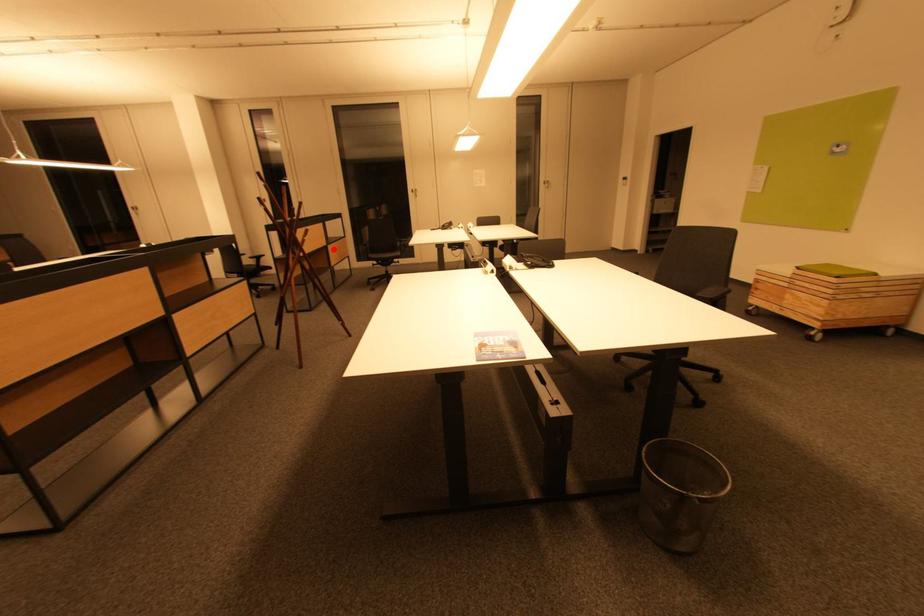
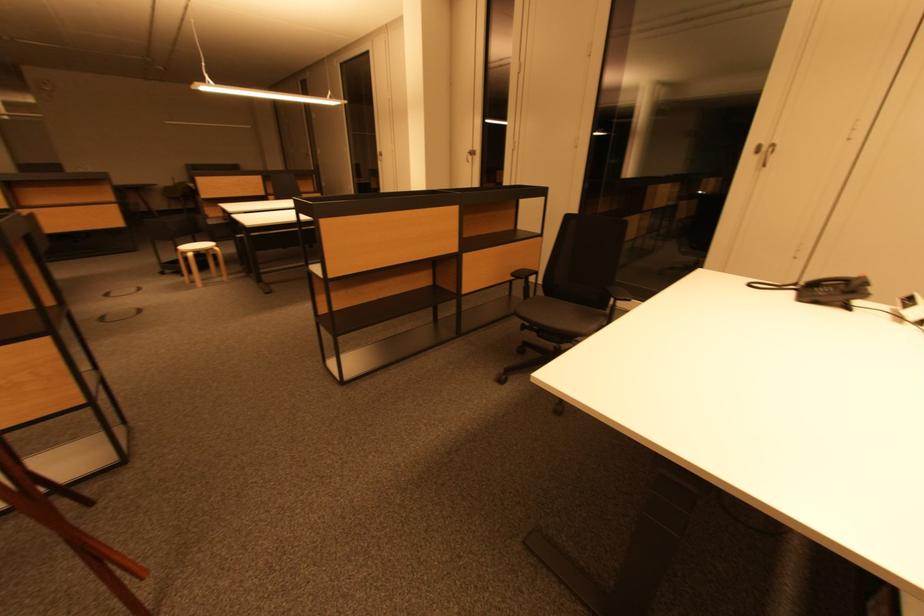
Question: I am providing you with two images of the same scene from different viewpoints. Given a red point in image1, look at the same physical point in image2. Is it:

Choices:
 (A) Closer to the viewpoint
 (B) Farther from the viewpoint

Answer: (B)